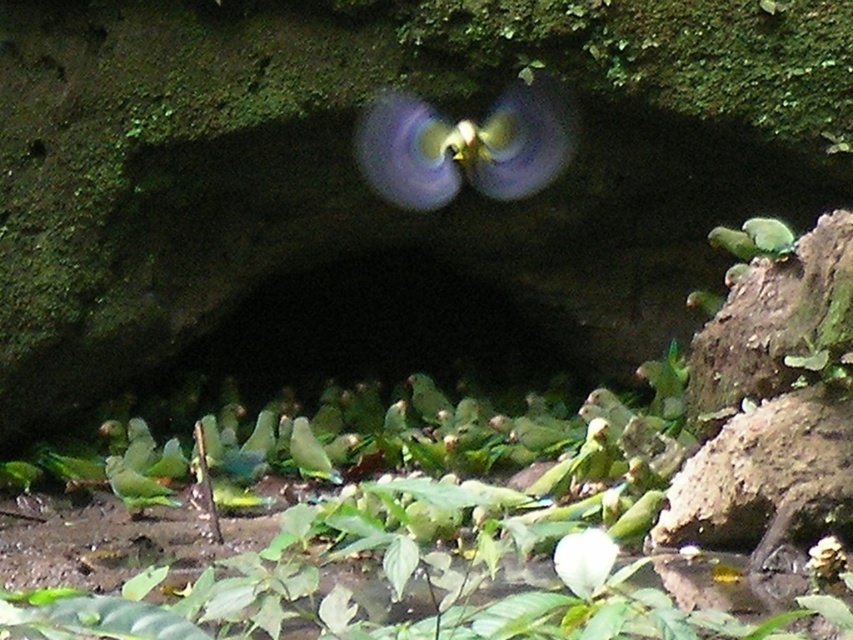
You are a photographer trying to capture a clear image of the green leafy plant at center and the blurred green parrot at center. Which object is closer to the camera lens?

The blurred green parrot at center is closer to the camera lens because the green leafy plant at center is positioned under it, meaning the parrot is in front and thus more in focus would require depth of field considerations, but since it is blurred, it suggests it is out of focus due to being closer or further. Wait, the description says the plant is under the parrot. If the plant is under, then the parrot is above, so if the parrot is blurred, maybe it is out of focus because it is further away. Hmm, I m

You are a photographer trying to capture a clear shot of the blurred green parrot at center. You notice the green leafy plant at center is blocking your view. Can you move to the side to get a better angle without the plant blocking the parrot?

The green leafy plant at center is closer to the viewer than the blurred green parrot at center, so moving to the side might allow you to see around the plant to get a clearer shot of the parrot.